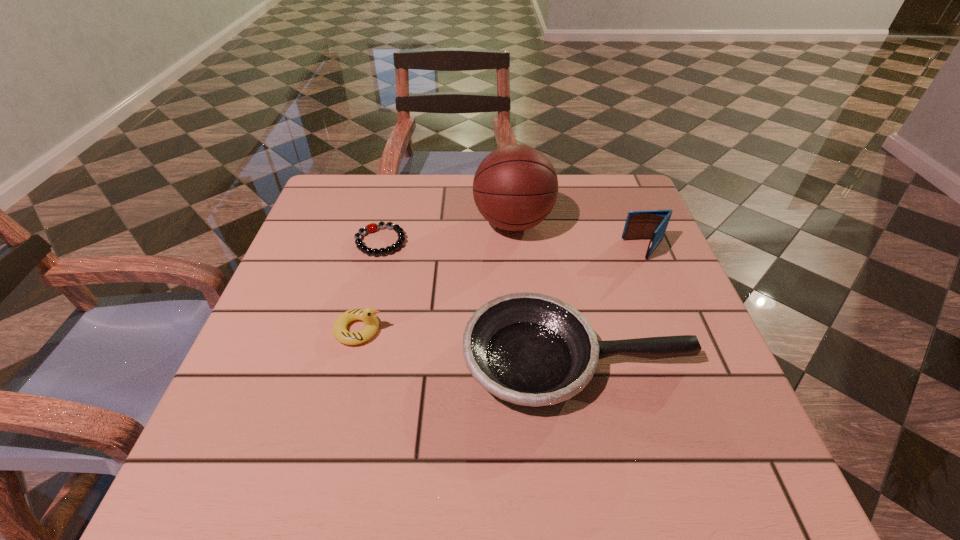
What are the coordinates of `free space between the duckling and the tallest object` in the screenshot? It's located at (436, 276).

This screenshot has width=960, height=540. Identify the location of vacant space that is in between the duckling and the wallet. (502, 289).

The width and height of the screenshot is (960, 540). Find the location of `free space between the wallet and the basketball`. free space between the wallet and the basketball is located at coordinates (580, 236).

The image size is (960, 540). What are the coordinates of `vacant point located between the second tallest object and the frying pan` in the screenshot? It's located at (612, 305).

What are the coordinates of `unoccupied position between the duckling and the basketball` in the screenshot? It's located at (436, 276).

What are the coordinates of `object identified as the third closest to the wallet` in the screenshot? It's located at (372, 227).

Identify which object is the nearest to the wallet. Please provide its 2D coordinates. Your answer should be formatted as a tuple, i.e. [(x, y)], where the tuple contains the x and y coordinates of a point satisfying the conditions above.

[(531, 349)]